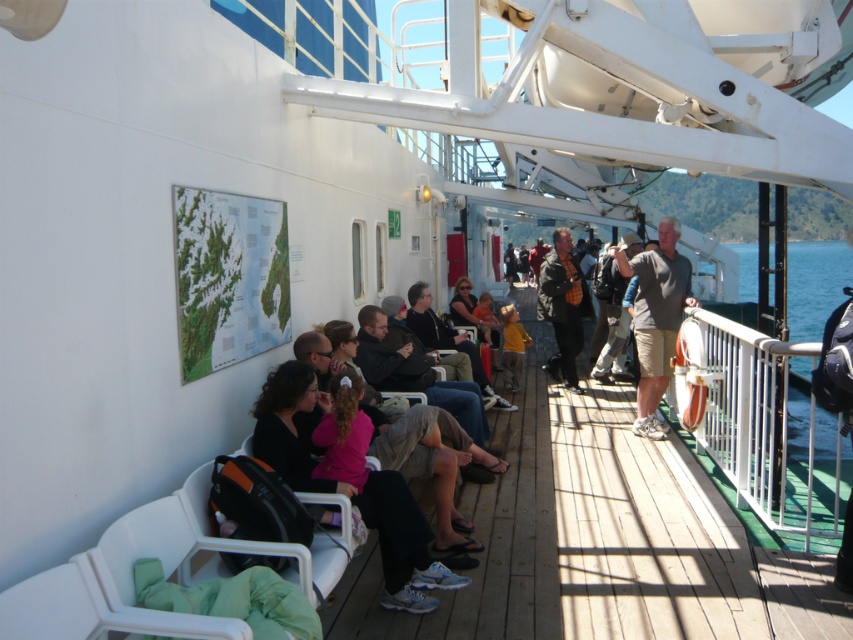
Question: From the image, what is the correct spatial relationship of gray cotton t-shirt at center in relation to matte black jacket at center?

Choices:
 (A) above
 (B) below

Answer: (B)

Question: Which object is closer to the camera taking this photo?

Choices:
 (A) gray cotton t-shirt at center
 (B) matte black jacket at center

Answer: (A)

Question: Is gray cotton t-shirt at center to the right of matte black jacket at center from the viewer's perspective?

Choices:
 (A) no
 (B) yes

Answer: (B)

Question: Which object appears farthest from the camera in this image?

Choices:
 (A) gray cotton t-shirt at center
 (B) matte black jacket at center

Answer: (B)

Question: Does gray cotton t-shirt at center have a lesser width compared to matte black jacket at center?

Choices:
 (A) yes
 (B) no

Answer: (B)